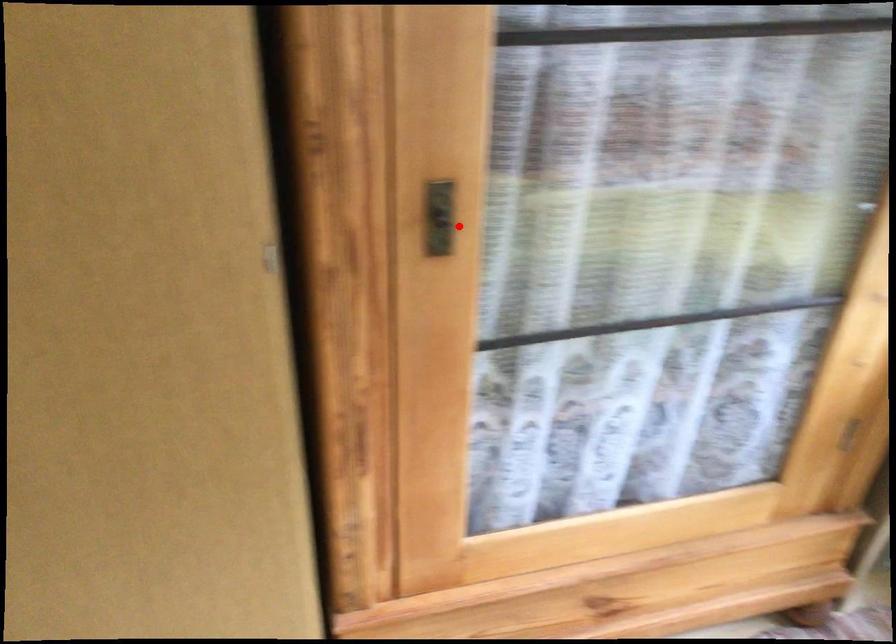
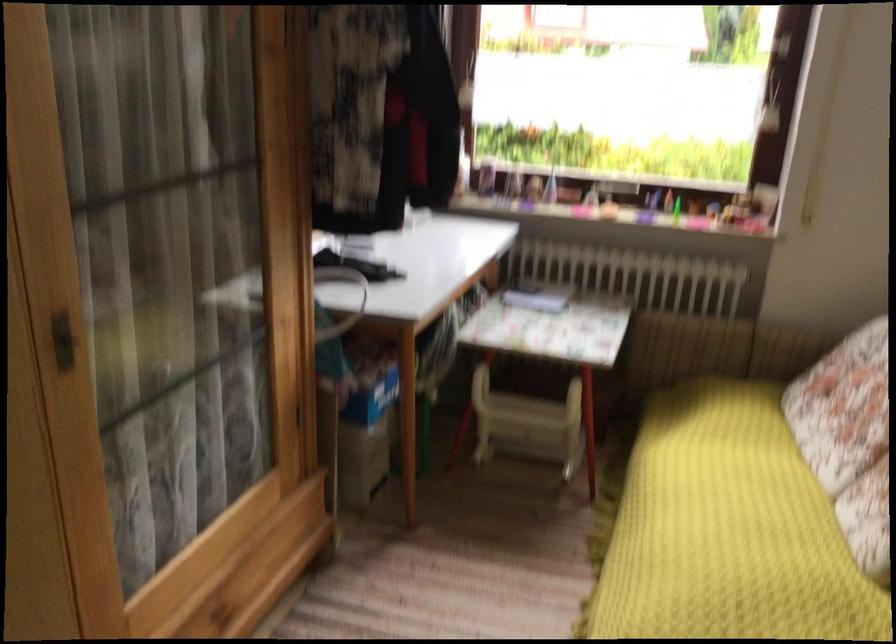
Question: I am providing you with two images of the same scene from different viewpoints. Image1 has a red point marked. In image2, the corresponding 3D location appears at what relative position? Reply with the corresponding letter.

Choices:
 (A) Closer
 (B) Farther

Answer: (B)